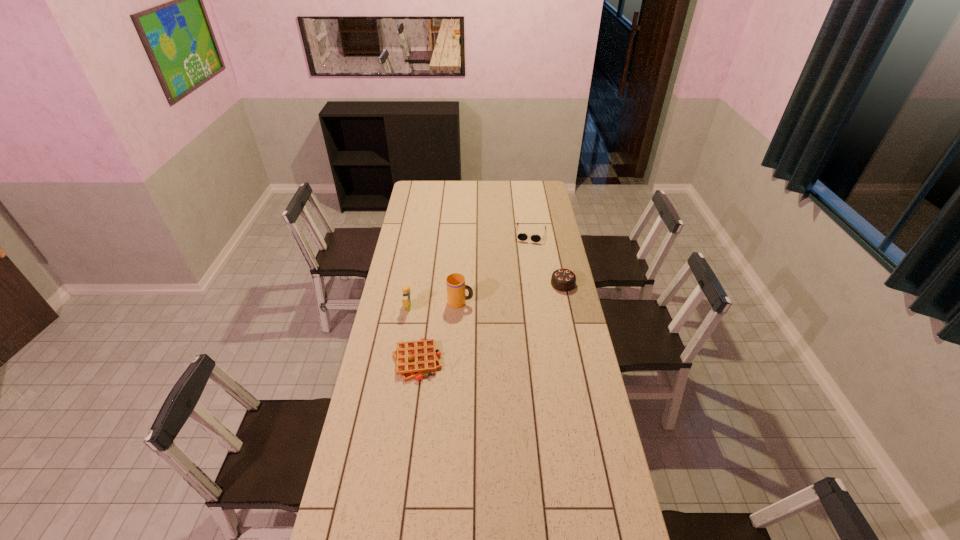
Image resolution: width=960 pixels, height=540 pixels. Find the location of `the nearest object`. the nearest object is located at coordinates pyautogui.click(x=413, y=359).

Find the location of a particular element. The image size is (960, 540). the shortest object is located at coordinates (413, 359).

Where is `the third tallest object`? The height and width of the screenshot is (540, 960). the third tallest object is located at coordinates (563, 280).

Where is `chocolate cake`? Image resolution: width=960 pixels, height=540 pixels. chocolate cake is located at coordinates (563, 280).

Where is `the tallest object`? The image size is (960, 540). the tallest object is located at coordinates point(456,297).

At what (x,y) coordinates should I click in order to perform the action: click on the third object from right to left. Please return your answer as a coordinate pair (x, y). Looking at the image, I should click on (456, 297).

I want to click on sunglasses, so click(x=521, y=236).

Where is `the farthest object`? the farthest object is located at coordinates coord(521,236).

Where is `Lego`? Lego is located at coordinates (406, 300).

What are the coordinates of `free space located on the back of the shortest object` in the screenshot? It's located at (423, 312).